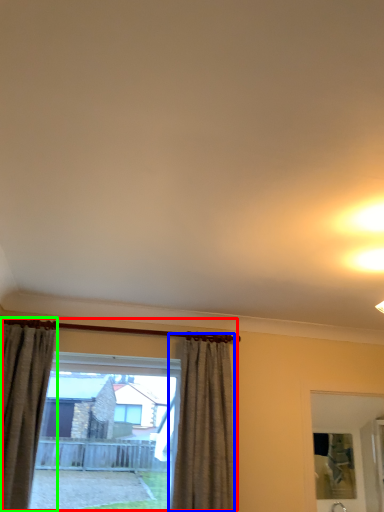
Question: Which object is the farthest from window (highlighted by a red box)? Choose among these: curtain (highlighted by a blue box) or curtain (highlighted by a green box).

Choices:
 (A) curtain
 (B) curtain

Answer: (B)